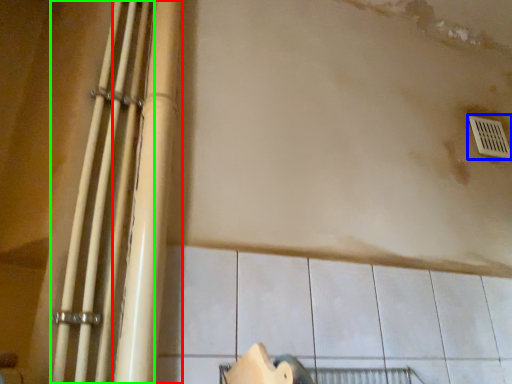
Question: Estimate the real-world distances between objects in this image. Which object is closer to beam (highlighted by a red box), window (highlighted by a blue box) or beam (highlighted by a green box)?

Choices:
 (A) window
 (B) beam

Answer: (B)